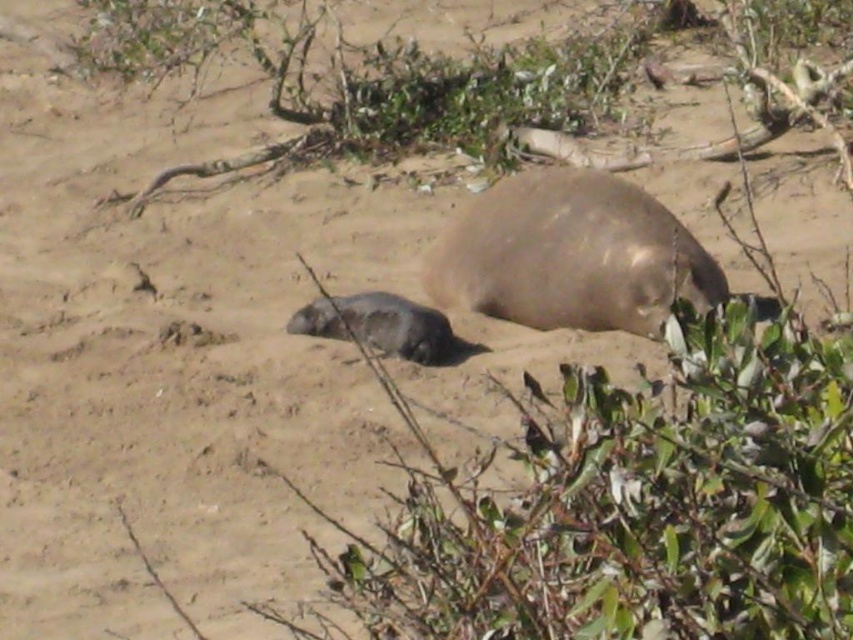
Question: Does gray fur seal at center have a smaller size compared to gray fur seal pup at center?

Choices:
 (A) yes
 (B) no

Answer: (B)

Question: Does gray fur seal at center lie in front of gray fur seal pup at center?

Choices:
 (A) no
 (B) yes

Answer: (B)

Question: Can you confirm if gray fur seal at center is wider than gray fur seal pup at center?

Choices:
 (A) no
 (B) yes

Answer: (B)

Question: Which point is closer to the camera?

Choices:
 (A) (654, 310)
 (B) (306, 320)

Answer: (A)

Question: Among these objects, which one is farthest from the camera?

Choices:
 (A) gray fur seal pup at center
 (B) gray fur seal at center

Answer: (A)